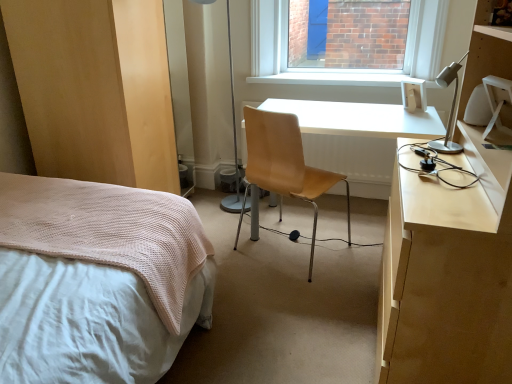
The height and width of the screenshot is (384, 512). What are the coordinates of `free space above white glossy desk at center (from a real-world perspective)` in the screenshot? It's located at (360, 118).